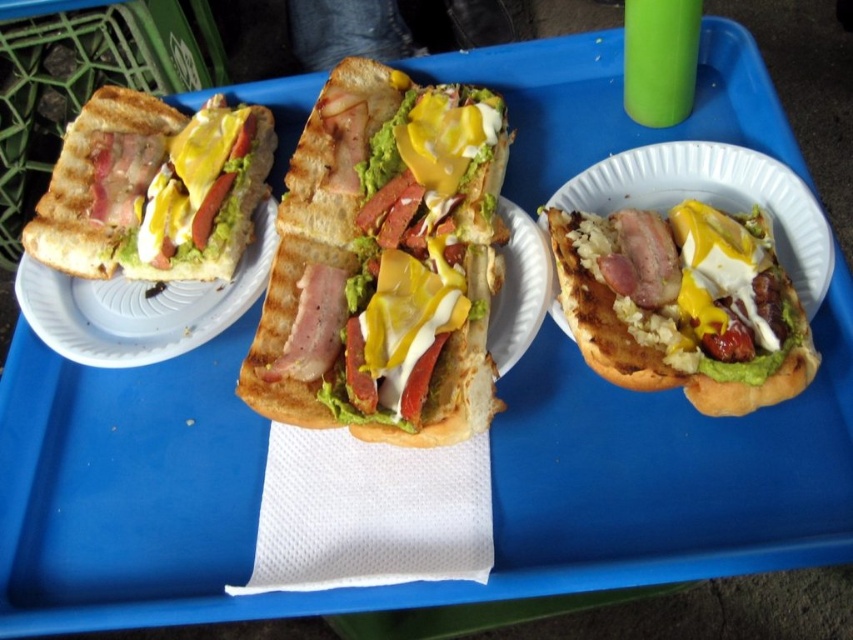
Question: Which object is positioned closest to the yellow creamy cheese at center?

Choices:
 (A) matte white bread at right
 (B) matte black sandwich at left

Answer: (A)

Question: Is matte black sandwich at left above matte yellow cheese at left?

Choices:
 (A) yes
 (B) no

Answer: (A)

Question: Which point is closer to the camera?

Choices:
 (A) matte white bread at right
 (B) yellow creamy cheese at center

Answer: (A)

Question: Does matte black sandwich at left have a smaller size compared to yellow creamy cheese at center?

Choices:
 (A) yes
 (B) no

Answer: (B)

Question: Does grilled bread sandwich at center appear over yellow creamy cheese at center?

Choices:
 (A) yes
 (B) no

Answer: (A)

Question: Which object is the closest to the grilled bread sandwich at center?

Choices:
 (A) yellow creamy cheese at center
 (B) matte white bread at right

Answer: (B)